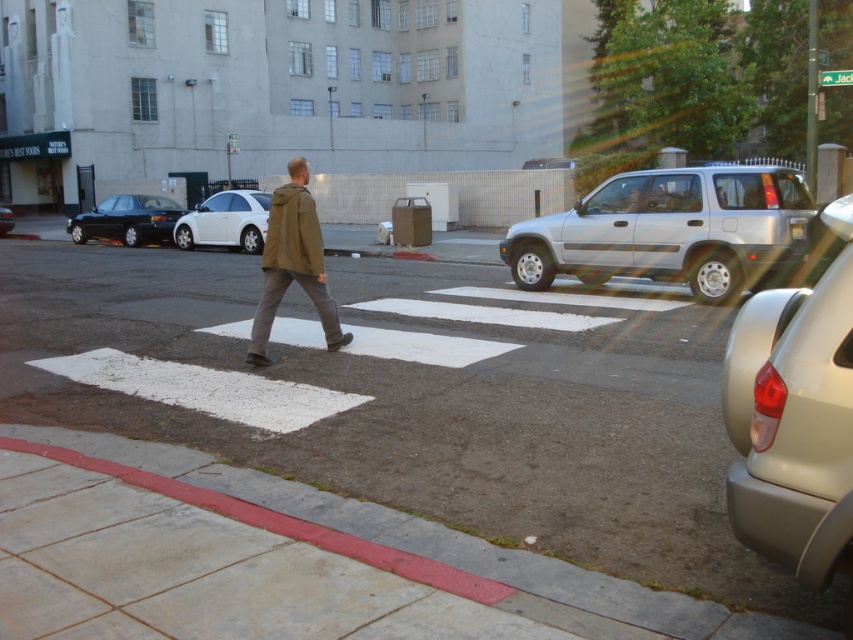
Question: Among these points, which one is nearest to the camera?

Choices:
 (A) (838, 525)
 (B) (263, 205)
 (C) (86, 234)

Answer: (A)

Question: Where is matte silver suv at right located in relation to white matte hatchback at center in the image?

Choices:
 (A) below
 (B) above

Answer: (A)

Question: Among these points, which one is nearest to the camera?

Choices:
 (A) (235, 227)
 (B) (277, 189)

Answer: (B)

Question: Can you confirm if matte silver suv at right is positioned below silver metallic suv at center-right?

Choices:
 (A) no
 (B) yes

Answer: (B)

Question: Which object is farther from the camera taking this photo?

Choices:
 (A) olive-green fabric jacket at center
 (B) matte black sedan at center

Answer: (B)

Question: Is olive-green fabric jacket at center further to the viewer compared to white matte hatchback at center?

Choices:
 (A) yes
 (B) no

Answer: (B)